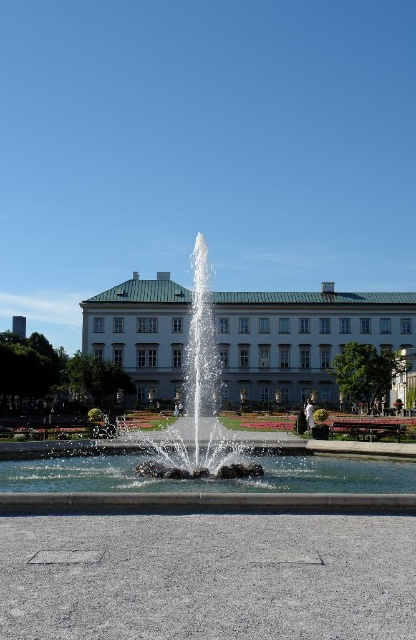
Is point (277, 380) closer to camera compared to point (415, 500)?

No, (277, 380) is further to viewer.

Which is in front, point (302, 352) or point (163, 444)?

Positioned in front is point (163, 444).

Describe the element at coordinates (302, 339) in the screenshot. I see `white smooth building at center` at that location.

I want to click on white smooth building at center, so click(x=302, y=339).